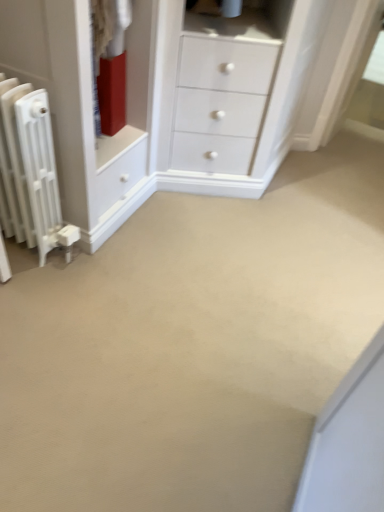
Image resolution: width=384 pixels, height=512 pixels. I want to click on free space in front of white matte radiator at left, so [x=28, y=292].